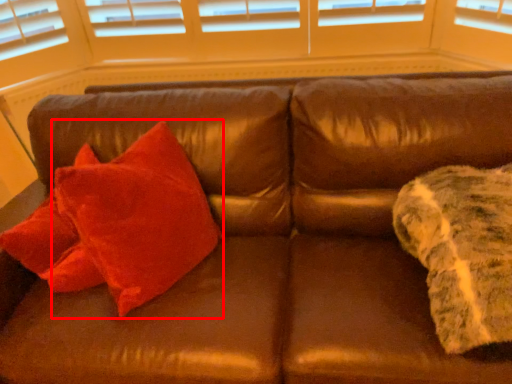
Question: Observing the image, what is the correct spatial positioning of throw pillow (annotated by the red box) in reference to blanket?

Choices:
 (A) right
 (B) left

Answer: (B)